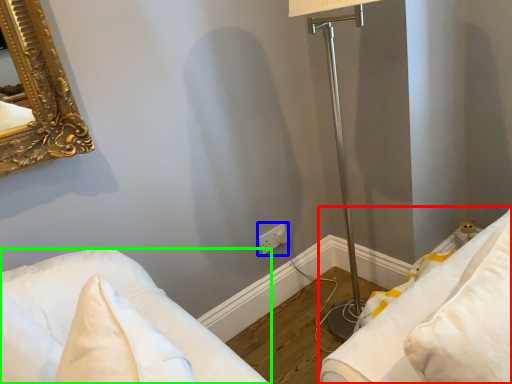
Question: Based on their relative distances, which object is nearer to furniture (highlighted by a red box)? Choose from electric outlet (highlighted by a blue box) and furniture (highlighted by a green box).

Choices:
 (A) electric outlet
 (B) furniture

Answer: (B)